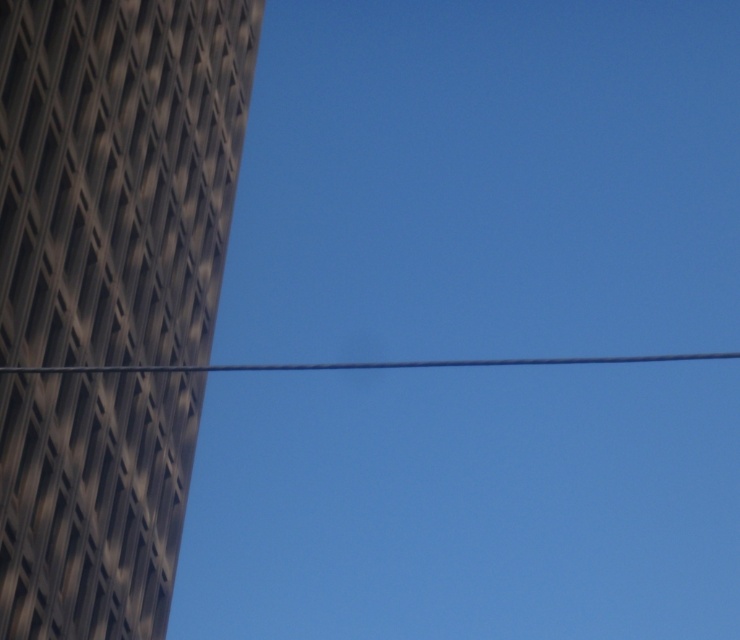
From the picture: You are a photographer trying to capture the dark brown textured tower at left and the metallic wire at center in your shot. Based on their sizes, which object should you focus on first to ensure it fits entirely within the frame?

The dark brown textured tower at left has a smaller size compared to the metallic wire at center, so you should focus on capturing the metallic wire at center first since it is larger and requires more attention to fit properly in the frame.

You are a window cleaner standing on the ground looking at the dark brown textured tower at left and the metallic wire at center. Which object is higher from the ground?

The dark brown textured tower at left is above the metallic wire at center, so the dark brown textured tower at left is higher from the ground.

You are an architect analyzing the building structure. The dark brown textured tower at left and the metallic wire at center are both in your view. Which object has a greater width according to the scene?

The metallic wire at center has a greater width than the dark brown textured tower at left.